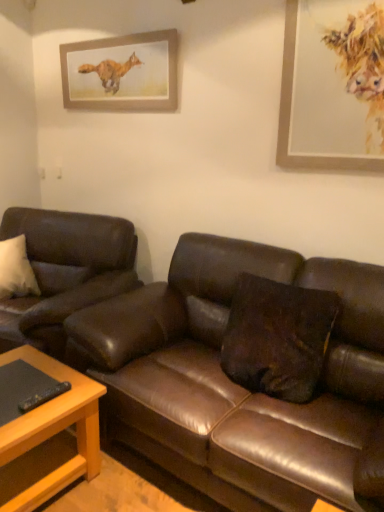
Locate an element on the screen. vacant space situated above wooden picture frame at upper center, positioned as the 1th picture frame in back-to-front order (from a real-world perspective) is located at coordinates pyautogui.click(x=104, y=37).